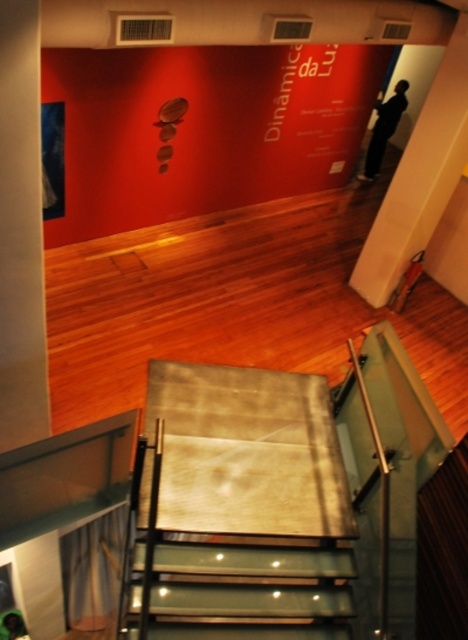
You are an interior designer looking at the gallery layout. You need to place a new sculpture that requires a clear view of the clear glass stairs at center. Where should you position it relative to the black matte pants at upper right?

You should position the sculpture to the left of the black matte pants at upper right so it can have a clear view of the clear glass stairs at center, since the clear glass stairs at center are located to the left of the black matte pants at upper right.

You are standing in the gallery and want to take a photo of both the black matte pants at upper right and the green fabric person at lower left. Which object should you focus on first to ensure both are in clear view?

You should focus on the black matte pants at upper right first because it is closer to you than the green fabric person at lower left, ensuring both are in clear view.